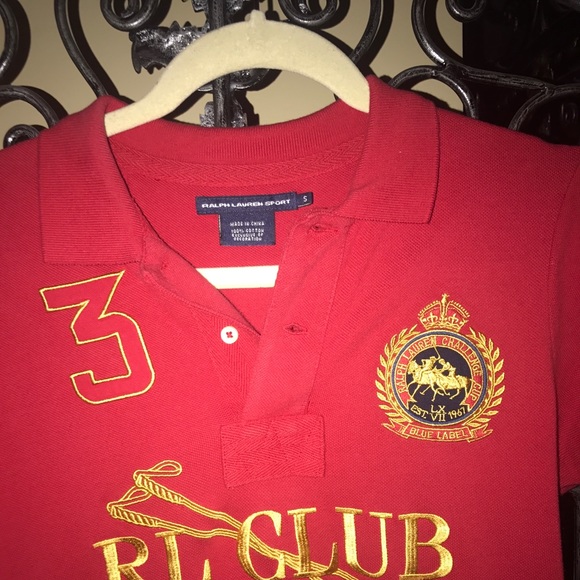
Where is `brown wooden hanger`? brown wooden hanger is located at coordinates (255, 55).